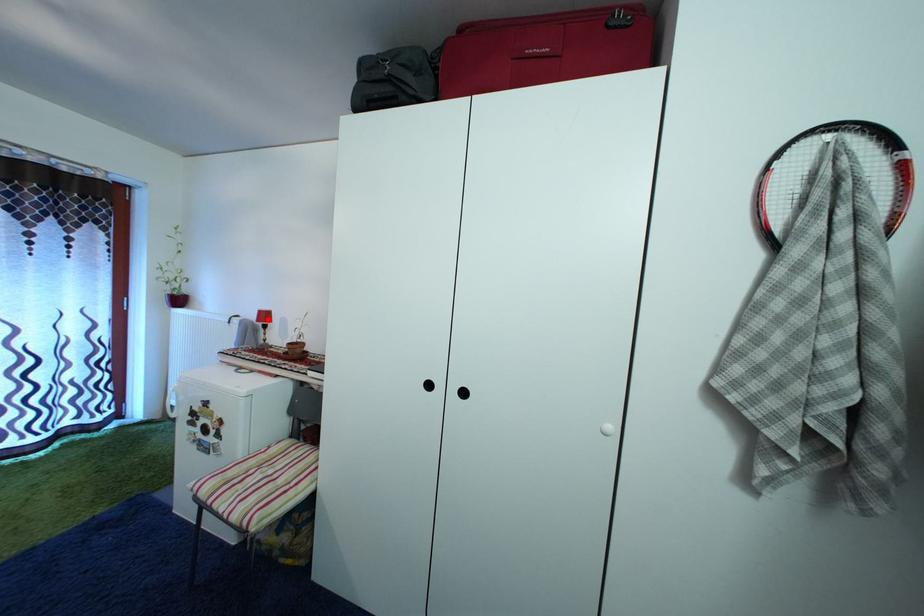
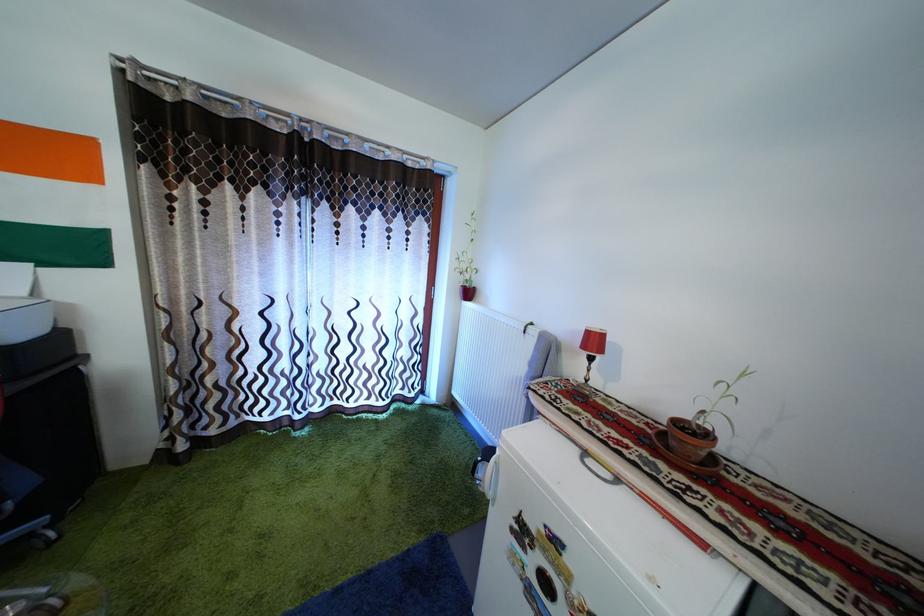
Locate, in the second image, the point that corresponds to the highlighted location in the first image.

(598, 339)